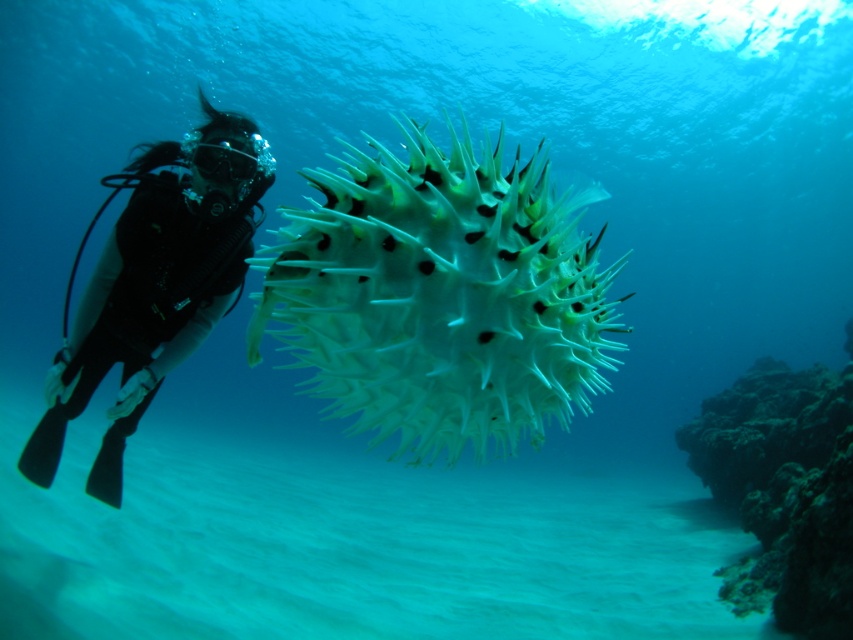
You are a marine biologist studying underwater creatures. You are currently at the coordinates point 0.5, 0.5. You see the translucent spiky fish at center. Can you determine if the fish is directly in front of you?

The translucent spiky fish at center is located at point (x=440, y=296), which is very close to your current coordinates of (x=426, y=320). Therefore, the fish is directly in front of you.

You are a marine biologist studying underwater creatures. You observe the translucent spiky fish at center and the black matte scuba diver at left. Which object is located below the other?

The translucent spiky fish at center is positioned under the black matte scuba diver at left.

You are a marine biologist studying underwater ecosystems. You observe the translucent spiky fish at center and the dark brown rocky coral reef at lower right. Which object is located higher in the water column?

The translucent spiky fish at center is positioned over the dark brown rocky coral reef at lower right, meaning it is higher in the water column.